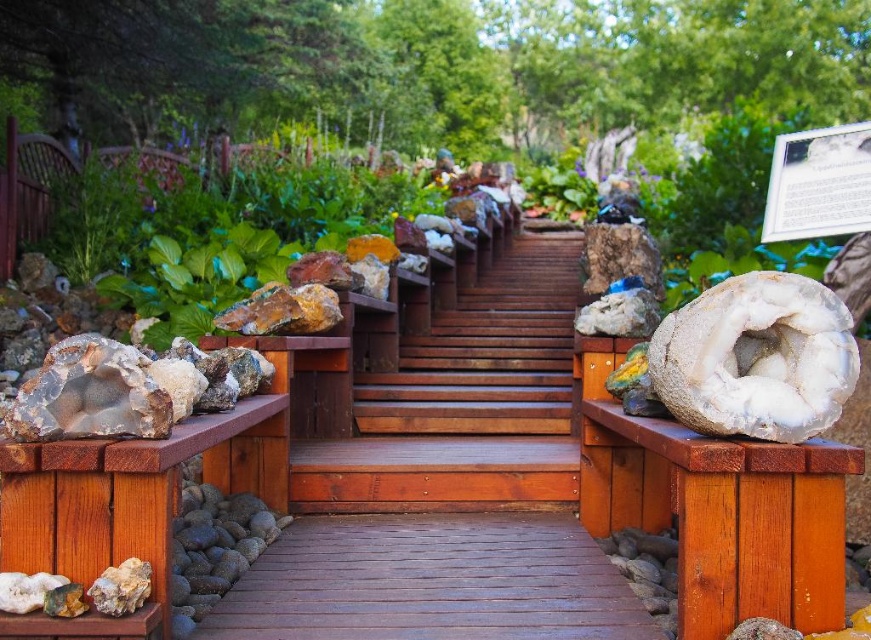
Is translucent white crystal at center below gray rock at lower left?

Incorrect, translucent white crystal at center is not positioned below gray rock at lower left.

Does translucent white crystal at center have a greater height compared to gray rock at lower left?

Yes, translucent white crystal at center is taller than gray rock at lower left.

You are a GUI agent. You are given a task and a screenshot of the screen. Output one action in this format:
    pyautogui.click(x=<x>, y=<y>)
    Task: Click on the translucent white crystal at center
    
    Given the screenshot: What is the action you would take?
    pyautogui.click(x=755, y=358)

Can you confirm if smooth wooden path at center is taller than brown wooden stairs at center?

No.

Is smooth wooden path at center thinner than brown wooden stairs at center?

Yes, smooth wooden path at center is thinner than brown wooden stairs at center.

Between point (323, 620) and point (565, 236), which one is positioned in front?

Point (323, 620) is more forward.

Find the location of a particular element. The width and height of the screenshot is (871, 640). smooth wooden path at center is located at coordinates (431, 582).

Does brown wooden stairs at center have a lesser height compared to translucent white crystal at center?

Incorrect, brown wooden stairs at center's height does not fall short of translucent white crystal at center's.

From the picture: Is brown wooden stairs at center taller than translucent white crystal at center?

Indeed, brown wooden stairs at center has a greater height compared to translucent white crystal at center.

Which is in front, point (532, 432) or point (770, 404)?

Point (770, 404) is in front.

Find the location of a particular element. The image size is (871, 640). brown wooden stairs at center is located at coordinates (487, 355).